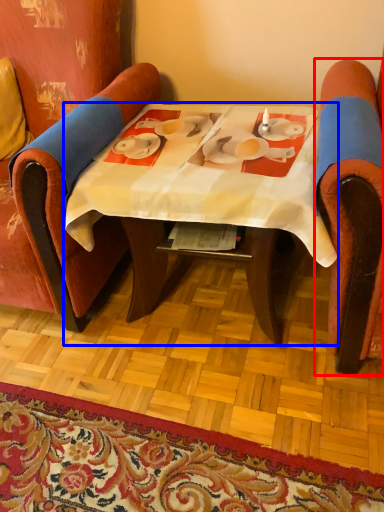
Question: Among these objects, which one is nearest to the camera, chair (highlighted by a red box) or table (highlighted by a blue box)?

Choices:
 (A) chair
 (B) table

Answer: (A)